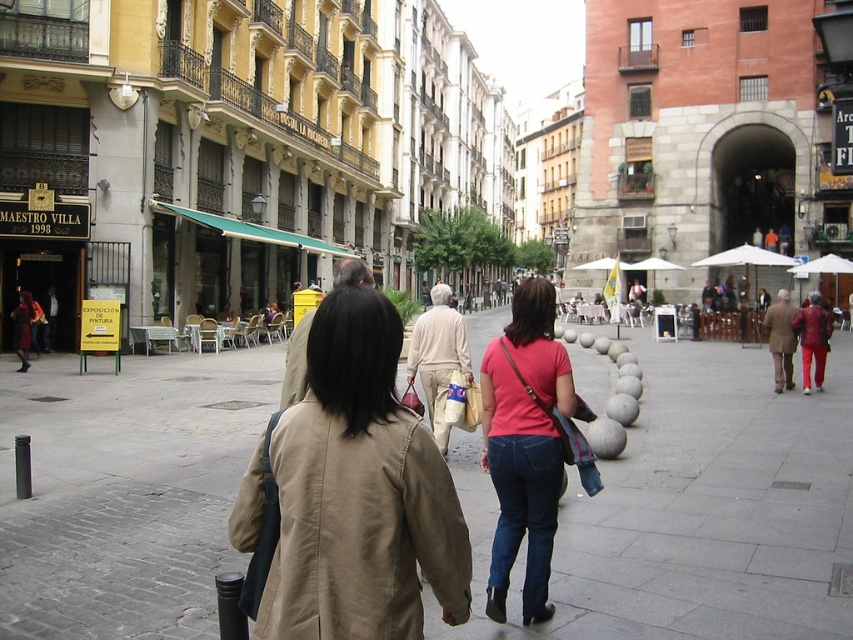
You are a photographer positioned at the end of the street. You want to capture both the tan fabric trench coat at center and the matte pink shirt at center in your shot. Which one will appear larger in the photo?

The tan fabric trench coat at center will appear larger in the photo because it is closer to the viewer than the matte pink shirt at center.

You are a delivery person trying to navigate a narrow path between two buildings. You see the gray concrete pavement at center and the tan fabric trench coat at center in your way. Can you pass through the path without moving the trench coat?

The gray concrete pavement at center is wider than the tan fabric trench coat at center, so you can pass through the path without moving the trench coat.